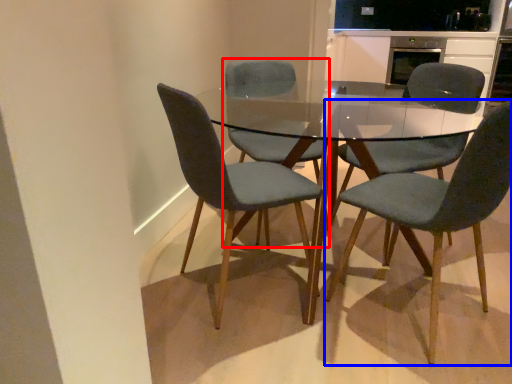
Question: Which of the following is the closest to the observer, chair (highlighted by a red box) or chair (highlighted by a blue box)?

Choices:
 (A) chair
 (B) chair

Answer: (B)